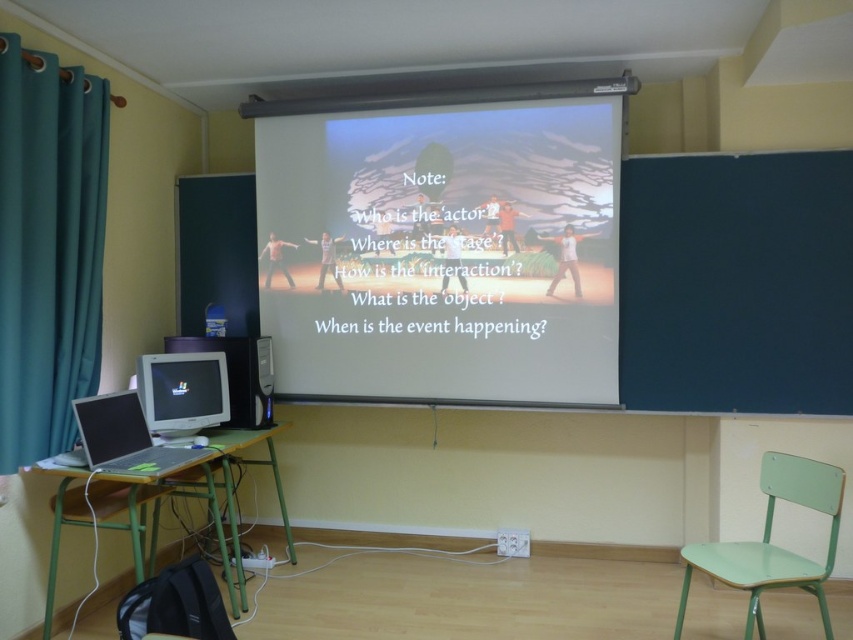
Question: Is green matte chair at lower right bigger than matte silver monitor at lower left?

Choices:
 (A) no
 (B) yes

Answer: (B)

Question: Is green plastic table at lower left wider than matte plastic monitor at lower left?

Choices:
 (A) no
 (B) yes

Answer: (B)

Question: In this image, where is matte silver monitor at lower left located relative to matte plastic monitor at lower left?

Choices:
 (A) below
 (B) above

Answer: (B)

Question: Which of these objects is positioned closest to the teal fabric curtain at left?

Choices:
 (A) matte silver monitor at lower left
 (B) white matte projection screen at center
 (C) silver metallic laptop at lower left

Answer: (C)

Question: Which of the following is the farthest from the observer?

Choices:
 (A) green matte chair at lower right
 (B) silver metallic laptop at lower left

Answer: (B)

Question: Which of the following is the closest to the observer?

Choices:
 (A) (747, 624)
 (B) (9, 218)
 (C) (231, 490)
 (D) (247, 358)

Answer: (A)